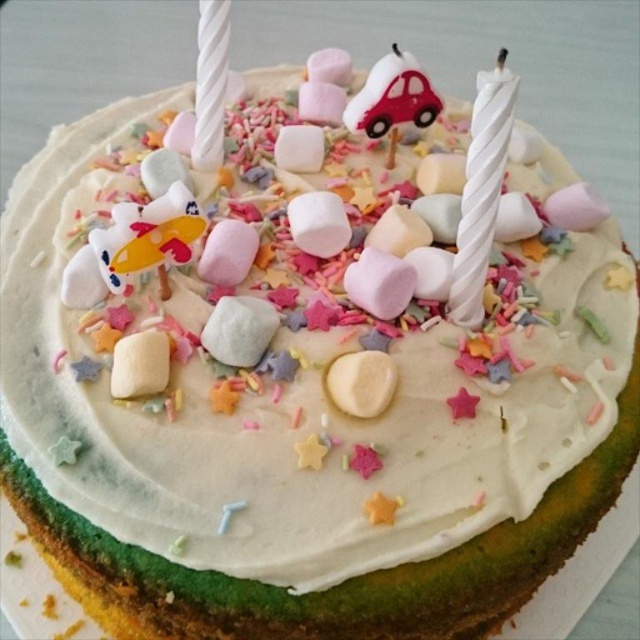
Question: Where is white twisted candle at upper right located in relation to white twisted candle at upper center in the image?

Choices:
 (A) left
 (B) right

Answer: (B)

Question: Can you confirm if white twisted candle at upper right is positioned below white twisted candle at upper center?

Choices:
 (A) yes
 (B) no

Answer: (A)

Question: Which point is closer to the camera?

Choices:
 (A) (218, 147)
 (B) (483, 257)

Answer: (B)

Question: Is the position of white twisted candle at upper right more distant than that of white twisted candle at upper center?

Choices:
 (A) yes
 (B) no

Answer: (B)

Question: Among these objects, which one is nearest to the camera?

Choices:
 (A) white twisted candle at upper right
 (B) white twisted candle at upper center

Answer: (A)